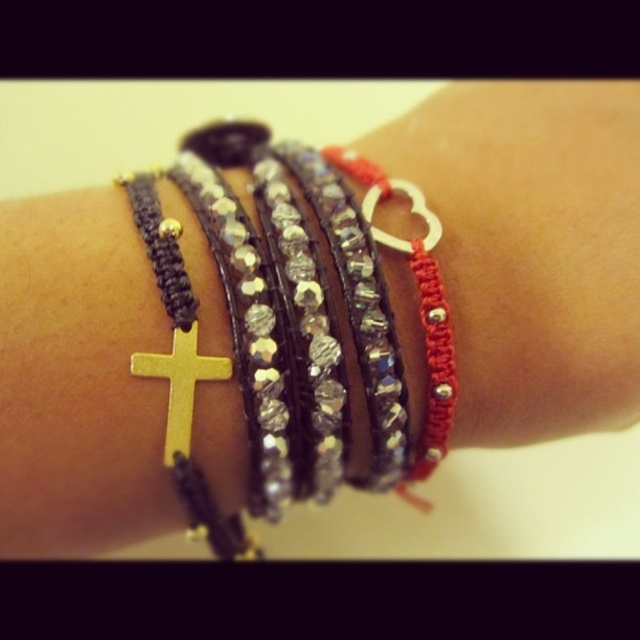
Looking at the wrist with multiple bracelets, where is the red beaded heart at center in relation to the gold metallic cross at center?

The red beaded heart at center is to the right of the gold metallic cross at center.

You are standing 5 feet away from the wrist shown in the image. If you want to touch the point at coordinates point (548, 147), will you be able to reach it without moving closer?

The point at coordinates point (548, 147) is 3.49 feet from the viewer. Since you are standing 5 feet away, you are farther than the required distance, so you cannot reach it without moving closer.

You are a jeweler trying to replicate the exact placement of the bracelets on a client. The client has specified that the red beaded heart at center must be placed precisely at coordinate point 0.391 on the x axis and 0.831 on the y axis. Can you confirm if the current placement matches the client requirements?

The position of red beaded heart at center is at point (531, 250), so yes, the current placement matches the client requirements exactly.